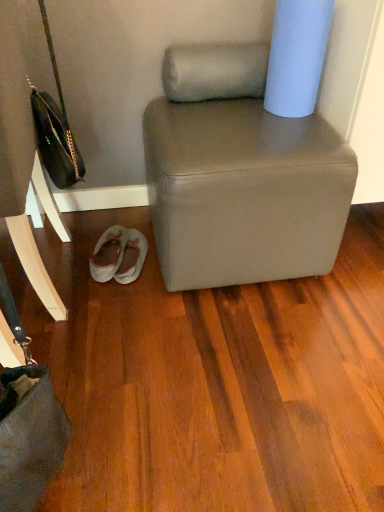
This screenshot has height=512, width=384. In order to click on light gray suede slippers at lower left in this screenshot , I will do `click(119, 255)`.

The height and width of the screenshot is (512, 384). What are the coordinates of `matte black handbag at left` in the screenshot? It's located at (55, 127).

This screenshot has height=512, width=384. What do you see at coordinates (244, 192) in the screenshot?
I see `matte gray ottoman at center` at bounding box center [244, 192].

This screenshot has width=384, height=512. What are the coordinates of `leather handbag at left` in the screenshot? It's located at (23, 164).

Can you confirm if matte black handbag at left is thinner than leather handbag at left?

Yes.

Is matte black handbag at left turned away from leather handbag at left?

Yes, matte black handbag at left is positioned with its back facing leather handbag at left.

Based on the photo, does matte gray ottoman at center have a lesser width compared to matte black handbag at left?

Incorrect, the width of matte gray ottoman at center is not less than that of matte black handbag at left.

Which is more to the right, matte gray ottoman at center or matte black handbag at left?

matte gray ottoman at center is more to the right.

Could you tell me if matte gray ottoman at center is turned towards matte black handbag at left?

No, matte gray ottoman at center does not turn towards matte black handbag at left.

I want to click on stool on the right of matte black handbag at left, so click(x=244, y=192).

How many degrees apart are the facing directions of light gray suede slippers at lower left and light blue matte toilet paper at upper right?

The facing directions of light gray suede slippers at lower left and light blue matte toilet paper at upper right are 0.000347 degrees apart.

Can you confirm if light gray suede slippers at lower left is bigger than light blue matte toilet paper at upper right?

Actually, light gray suede slippers at lower left might be smaller than light blue matte toilet paper at upper right.

From a real-world perspective, is light gray suede slippers at lower left under light blue matte toilet paper at upper right?

Yes, from a real-world perspective, light gray suede slippers at lower left is beneath light blue matte toilet paper at upper right.

Is light gray suede slippers at lower left at the right side of light blue matte toilet paper at upper right?

Incorrect, light gray suede slippers at lower left is not on the right side of light blue matte toilet paper at upper right.

Based on the photo, is the surface of matte gray ottoman at center in direct contact with light gray suede slippers at lower left?

No.

From a real-world perspective, relative to light gray suede slippers at lower left, is matte gray ottoman at center vertically above or below?

matte gray ottoman at center is situated higher than light gray suede slippers at lower left in the real world.

Would you say matte gray ottoman at center contains light gray suede slippers at lower left?

No, light gray suede slippers at lower left is located outside of matte gray ottoman at center.

In the scene shown: Considering the sizes of light blue matte toilet paper at upper right and matte black handbag at left in the image, is light blue matte toilet paper at upper right wider or thinner than matte black handbag at left?

light blue matte toilet paper at upper right is wider than matte black handbag at left.

Between light blue matte toilet paper at upper right and matte black handbag at left, which one has larger size?

matte black handbag at left.

From a real-world perspective, is light blue matte toilet paper at upper right positioned over matte black handbag at left based on gravity?

Yes, from a real-world perspective, light blue matte toilet paper at upper right is on top of matte black handbag at left.

Consider the image. Is light blue matte toilet paper at upper right shorter than matte black handbag at left?

Indeed, light blue matte toilet paper at upper right has a lesser height compared to matte black handbag at left.

Which object is closer to the camera taking this photo, light gray suede slippers at lower left or matte gray ottoman at center?

matte gray ottoman at center is in front.

Which of these two, light gray suede slippers at lower left or matte gray ottoman at center, is thinner?

light gray suede slippers at lower left.

Considering the sizes of light gray suede slippers at lower left and matte gray ottoman at center in the image, is light gray suede slippers at lower left taller or shorter than matte gray ottoman at center?

In the image, light gray suede slippers at lower left appears to be shorter than matte gray ottoman at center.

From the image's perspective, is light gray suede slippers at lower left below matte gray ottoman at center?

Correct, light gray suede slippers at lower left appears lower than matte gray ottoman at center in the image.

Based on the photo, considering the relative positions of matte gray ottoman at center and leather handbag at left in the image provided, is matte gray ottoman at center to the right of leather handbag at left from the viewer's perspective?

Indeed, matte gray ottoman at center is positioned on the right side of leather handbag at left.

Is matte gray ottoman at center located outside leather handbag at left?

Absolutely, matte gray ottoman at center is external to leather handbag at left.

Is there a large distance between matte gray ottoman at center and leather handbag at left?

No, matte gray ottoman at center is not far away from leather handbag at left.

Is point (181, 156) closer to viewer compared to point (40, 183)?

That is True.

Identify the location of furniture in front of the matte black handbag at left. The height and width of the screenshot is (512, 384). (23, 164).

This screenshot has width=384, height=512. In order to click on stool that appears behind the matte black handbag at left in this screenshot , I will do `click(244, 192)`.

Estimate the real-world distances between objects in this image. Which object is closer to matte black handbag at left, light gray suede slippers at lower left or leather handbag at left?

leather handbag at left is closer to matte black handbag at left.

Estimate the real-world distances between objects in this image. Which object is closer to matte black handbag at left, light blue matte toilet paper at upper right or matte gray ottoman at center?

matte gray ottoman at center is closer to matte black handbag at left.

From the image, which object appears to be farther from light blue matte toilet paper at upper right, light gray suede slippers at lower left or leather handbag at left?

Among the two, leather handbag at left is located further to light blue matte toilet paper at upper right.

Consider the image. Considering their positions, is leather handbag at left positioned closer to matte black handbag at left than matte gray ottoman at center?

Among the two, leather handbag at left is located nearer to matte black handbag at left.

Considering their positions, is matte gray ottoman at center positioned further to leather handbag at left than light gray suede slippers at lower left?

matte gray ottoman at center.

From the image, which object appears to be farther from light gray suede slippers at lower left, matte gray ottoman at center or leather handbag at left?

matte gray ottoman at center.

From the image, which object appears to be nearer to light blue matte toilet paper at upper right, matte black handbag at left or light gray suede slippers at lower left?

matte black handbag at left lies closer to light blue matte toilet paper at upper right than the other object.

From the image, which object appears to be farther from matte gray ottoman at center, matte black handbag at left or light blue matte toilet paper at upper right?

matte black handbag at left.

This screenshot has height=512, width=384. Find the location of `stool between leather handbag at left and light gray suede slippers at lower left from front to back`. stool between leather handbag at left and light gray suede slippers at lower left from front to back is located at coordinates (244, 192).

Where is `footwear between matte black handbag at left and light blue matte toilet paper at upper right`? Image resolution: width=384 pixels, height=512 pixels. footwear between matte black handbag at left and light blue matte toilet paper at upper right is located at coordinates (119, 255).

Locate an element on the screen. This screenshot has width=384, height=512. stool between leather handbag at left and light blue matte toilet paper at upper right in the horizontal direction is located at coordinates tap(244, 192).

Find the location of a particular element. The image size is (384, 512). stool located between matte black handbag at left and light blue matte toilet paper at upper right in the left-right direction is located at coordinates (244, 192).